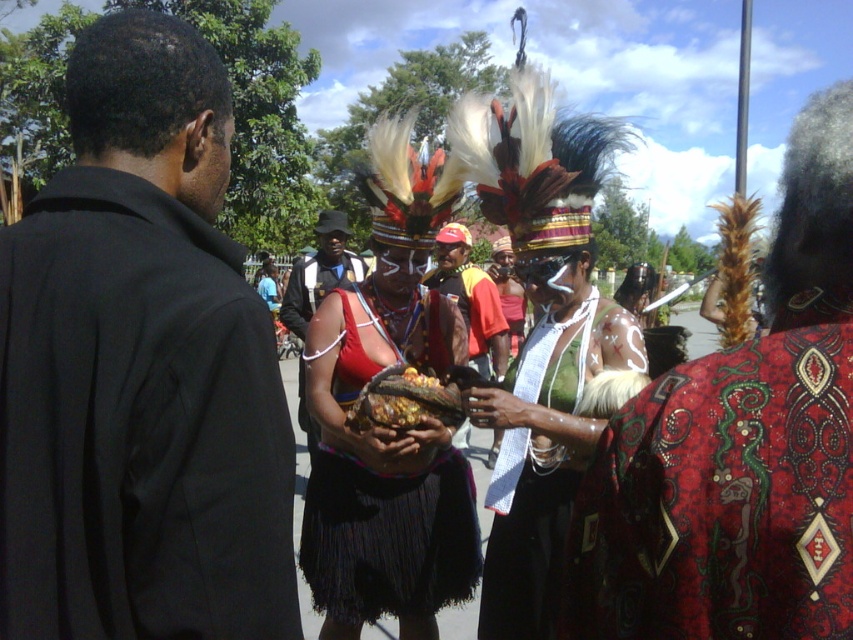
Which is above, red textured cloth at center or black fringed skirt at center?

red textured cloth at center is higher up.

From the picture: Does red textured cloth at center lie in front of black fringed skirt at center?

Yes, red textured cloth at center is in front of black fringed skirt at center.

Is point (712, 426) more distant than point (328, 429)?

No, it is in front of (328, 429).

The image size is (853, 640). I want to click on red textured cloth at center, so click(724, 497).

Where is `black fringed skirt at center`? black fringed skirt at center is located at coordinates (379, 481).

The height and width of the screenshot is (640, 853). What do you see at coordinates (379, 481) in the screenshot? I see `black fringed skirt at center` at bounding box center [379, 481].

This screenshot has width=853, height=640. In order to click on black fringed skirt at center in this screenshot , I will do `click(379, 481)`.

Is matte red shirt at center in front of matte red fabric at center?

Yes.

Between matte red shirt at center and matte red fabric at center, which one has more height?

With more height is matte red shirt at center.

The height and width of the screenshot is (640, 853). What do you see at coordinates (471, 300) in the screenshot?
I see `matte red shirt at center` at bounding box center [471, 300].

This screenshot has width=853, height=640. I want to click on matte red shirt at center, so click(471, 300).